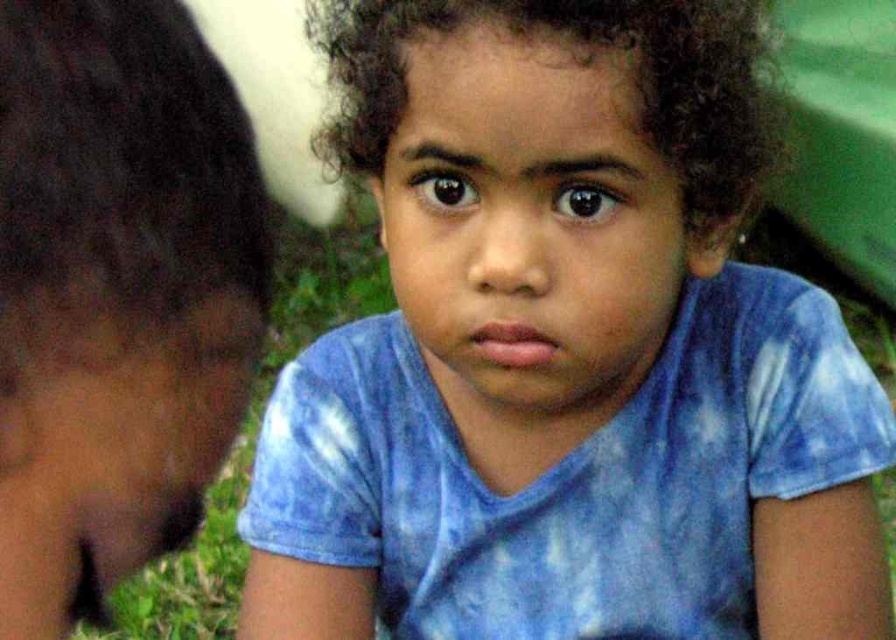
You are a photographer trying to capture the child in the scene. The child is standing in front of you, and you notice the brown hair at left and the green grass at lower left. How far apart are these two elements in the image?

The brown hair at left and the green grass at lower left are 5.57 feet apart from each other.